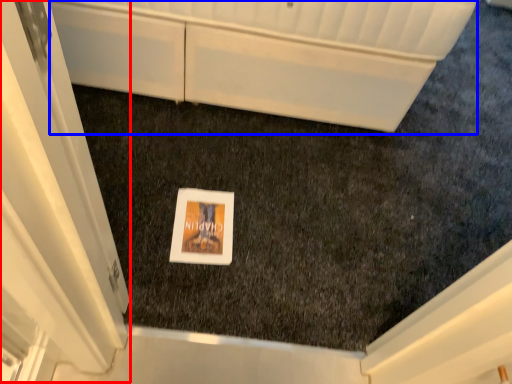
Question: Which of the following is the farthest to the observer, screen door (highlighted by a red box) or cabinetry (highlighted by a blue box)?

Choices:
 (A) screen door
 (B) cabinetry

Answer: (B)